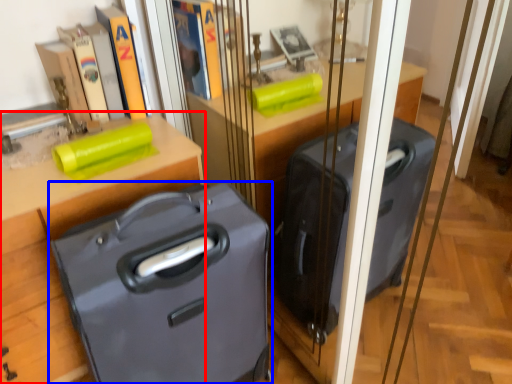
Question: Among these objects, which one is nearest to the camera, furniture (highlighted by a red box) or suitcase (highlighted by a blue box)?

Choices:
 (A) furniture
 (B) suitcase

Answer: (B)